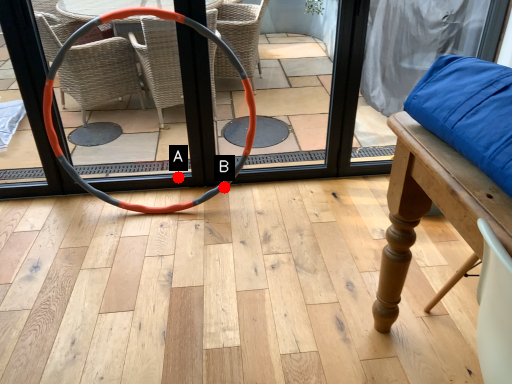
Question: Two points are circled on the image, labeled by A and B beside each circle. Which point appears closest to the camera in this image?

Choices:
 (A) A is closer
 (B) B is closer

Answer: (B)